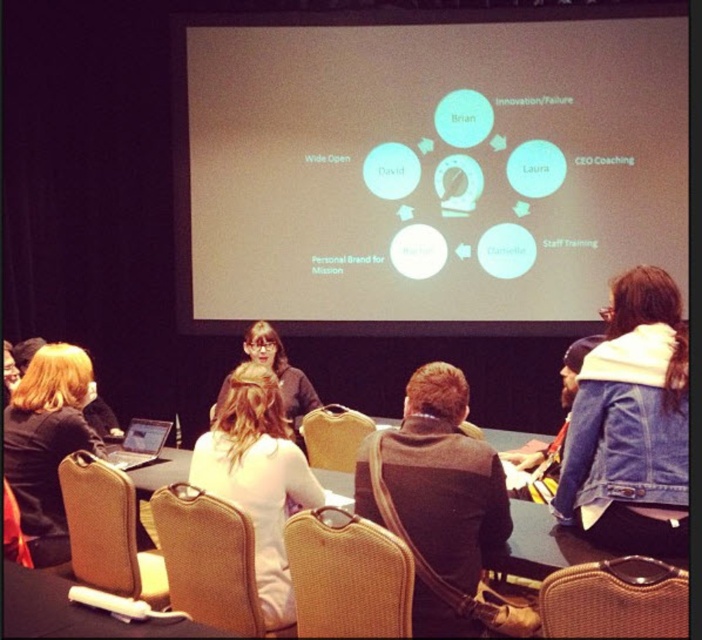
Question: Which object appears farthest from the camera in this image?

Choices:
 (A) white fabric shirt at center
 (B) braided wood chair at lower right
 (C) brown fabric chair at lower left

Answer: (C)

Question: Which is nearer to the matte black jacket at center?

Choices:
 (A) brown fabric chair at lower left
 (B) brown fabric chair at lower center
 (C) white matte projection screen at upper center
 (D) denim jacket at lower right

Answer: (A)

Question: Can you confirm if white matte projection screen at upper center is positioned to the right of white fabric shirt at center?

Choices:
 (A) no
 (B) yes

Answer: (B)

Question: Among these points, which one is farthest from the camera?

Choices:
 (A) (249, 339)
 (B) (51, 486)
 (C) (105, 564)

Answer: (A)

Question: Does braided wood chair at lower right appear over matte black jacket at center?

Choices:
 (A) yes
 (B) no

Answer: (B)

Question: Is white matte projection screen at upper center wider than denim jacket at lower right?

Choices:
 (A) no
 (B) yes

Answer: (B)